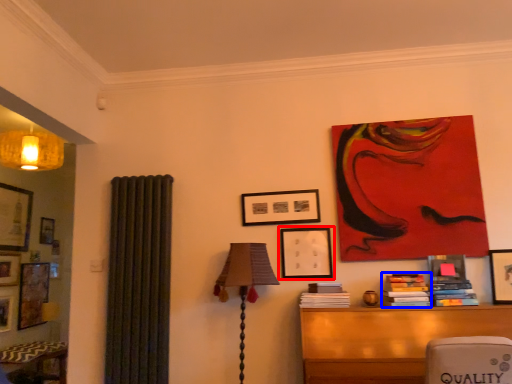
Question: Among these objects, which one is farthest to the camera, picture frame (highlighted by a red box) or book (highlighted by a blue box)?

Choices:
 (A) picture frame
 (B) book

Answer: (A)